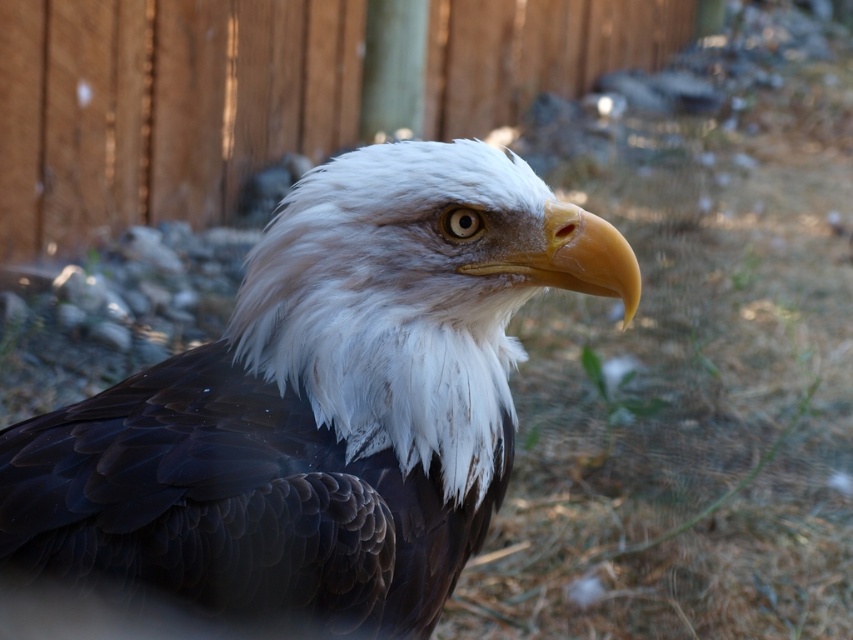
Who is more forward, [518,205] or [42,3]?

Positioned in front is point [518,205].

Between dark brown feathers at center and wooden fence at upper center, which one has more height?

wooden fence at upper center

Who is more forward, (450,554) or (259,19)?

Positioned in front is point (450,554).

I want to click on dark brown feathers at center, so click(x=312, y=406).

This screenshot has height=640, width=853. What do you see at coordinates (161, 108) in the screenshot?
I see `wooden fence at upper center` at bounding box center [161, 108].

Which is more to the right, wooden fence at upper center or yellow glossy beak at center?

Positioned to the right is yellow glossy beak at center.

Between point (61, 74) and point (622, 266), which one is positioned behind?

Point (61, 74)

At what (x,y) coordinates should I click in order to perform the action: click on wooden fence at upper center. Please return your answer as a coordinate pair (x, y). The width and height of the screenshot is (853, 640). Looking at the image, I should click on (161, 108).

Is point (267, 480) less distant than point (619, 248)?

Yes.

Where is `dark brown feathers at center`? dark brown feathers at center is located at coordinates (312, 406).

Locate an element on the screen. The image size is (853, 640). dark brown feathers at center is located at coordinates (312, 406).